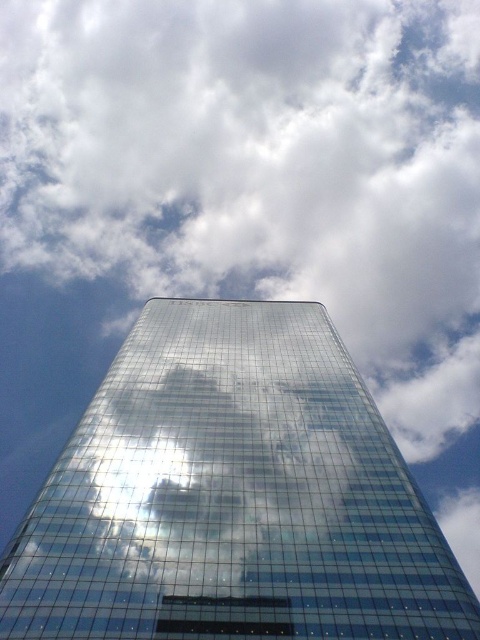
Question: Can you confirm if transparent glass tower at center is bigger than transparent glass building at center?

Choices:
 (A) no
 (B) yes

Answer: (B)

Question: Can you confirm if transparent glass tower at center is positioned below transparent glass building at center?

Choices:
 (A) yes
 (B) no

Answer: (B)

Question: Observing the image, what is the correct spatial positioning of transparent glass tower at center in reference to transparent glass building at center?

Choices:
 (A) above
 (B) below

Answer: (A)

Question: Which of the following is the closest to the observer?

Choices:
 (A) transparent glass building at center
 (B) transparent glass tower at center

Answer: (B)